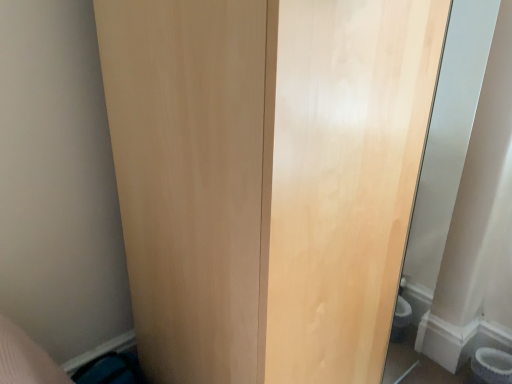
Based on the photo, measure the distance between point (131, 1) and camera.

A distance of 33.70 inches exists between point (131, 1) and camera.

The width and height of the screenshot is (512, 384). Identify the location of light wood door at center. (266, 179).

What is the approximate width of light wood door at center?

It is 72.60 centimeters.

The image size is (512, 384). What do you see at coordinates (266, 179) in the screenshot?
I see `light wood door at center` at bounding box center [266, 179].

Identify the location of light wood door at center. The height and width of the screenshot is (384, 512). (266, 179).